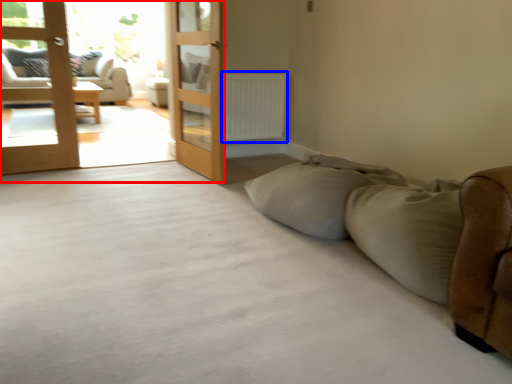
Question: Which object is closer to the camera taking this photo, terrace (highlighted by a red box) or radiator (highlighted by a blue box)?

Choices:
 (A) terrace
 (B) radiator

Answer: (A)